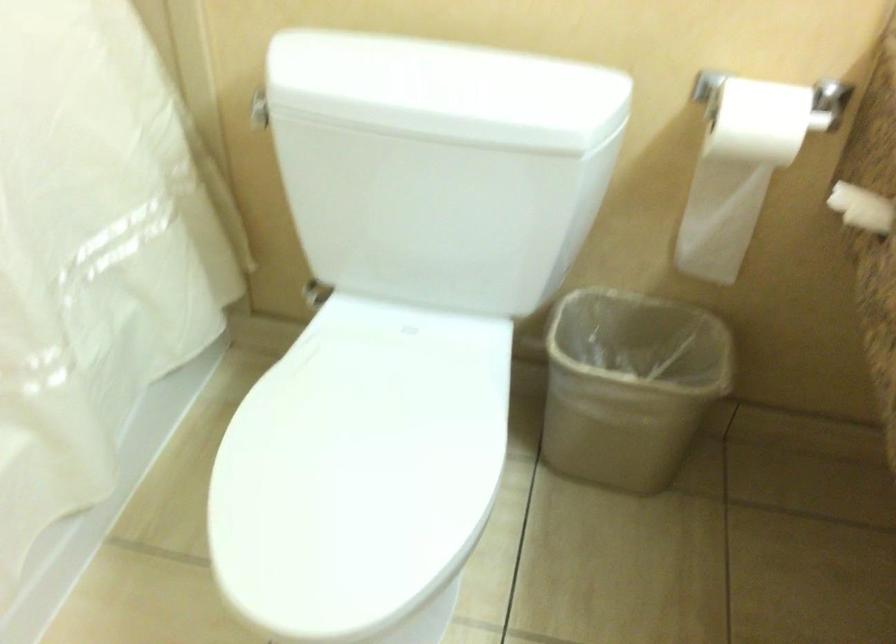
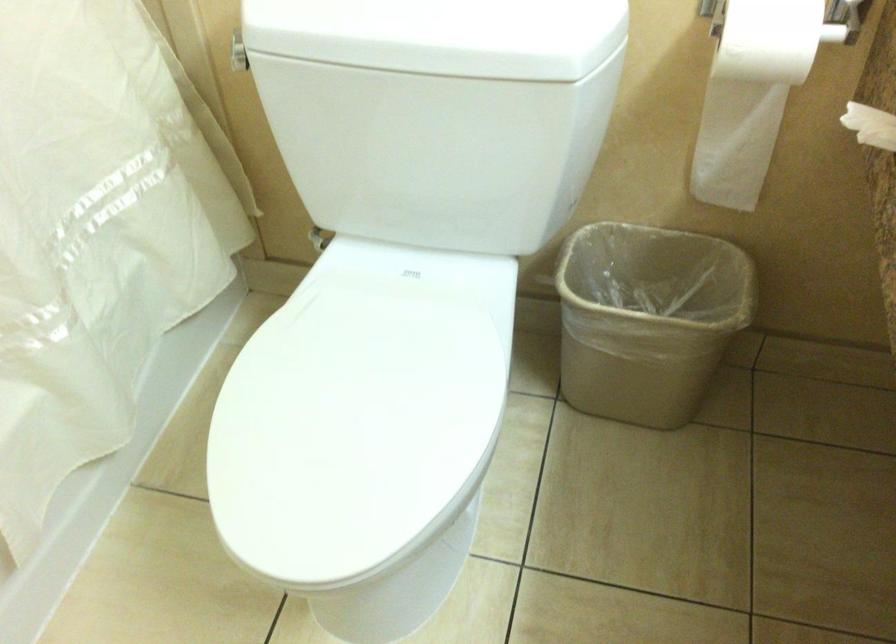
Locate, in the second image, the point that corresponds to point (417, 102) in the first image.

(393, 35)